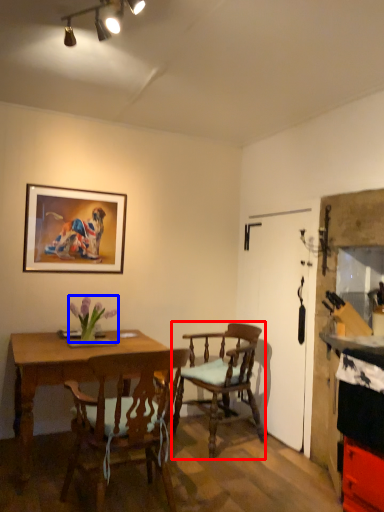
Question: Among these objects, which one is farthest to the camera, chair (highlighted by a red box) or flower (highlighted by a blue box)?

Choices:
 (A) chair
 (B) flower

Answer: (A)